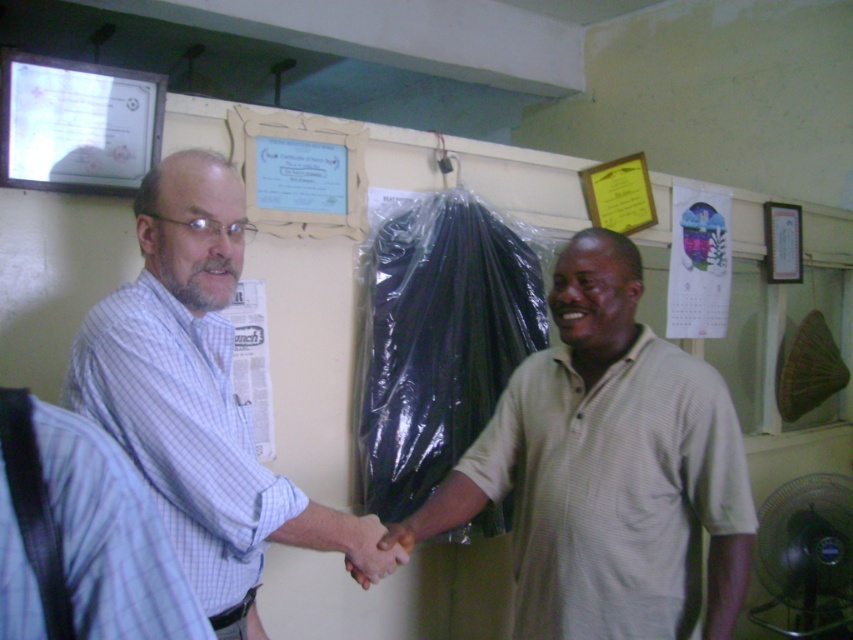
Who is positioned more to the left, beige cotton shirt at center or white striped shirt at center?

Positioned to the left is white striped shirt at center.

Does beige cotton shirt at center have a greater height compared to white striped shirt at center?

A: In fact, beige cotton shirt at center may be shorter than white striped shirt at center.

Is point (563, 252) positioned behind point (196, 570)?

Yes, it is.

In order to click on beige cotton shirt at center in this screenshot , I will do `click(608, 468)`.